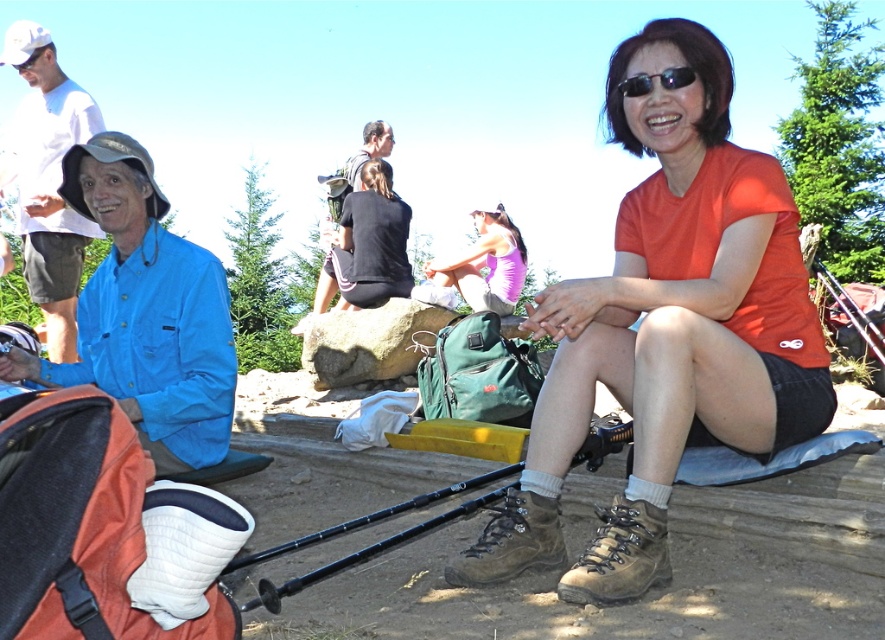
Question: Which object appears farthest from the camera in this image?

Choices:
 (A) blue fabric shirt at left
 (B) purple fabric top at center
 (C) dark gray backpack at center

Answer: (C)

Question: Which object is closer to the camera taking this photo?

Choices:
 (A) orange matte shirt at center
 (B) blue fabric jacket at upper left
 (C) blue fabric shirt at left

Answer: (A)

Question: Which object appears closest to the camera in this image?

Choices:
 (A) purple fabric top at center
 (B) dark gray backpack at center

Answer: (A)

Question: Is orange matte shirt at center to the left of black plastic pole at lower center from the viewer's perspective?

Choices:
 (A) no
 (B) yes

Answer: (A)

Question: From the image, what is the correct spatial relationship of blue fabric shirt at left in relation to purple fabric top at center?

Choices:
 (A) right
 (B) left

Answer: (B)

Question: Is the position of blue fabric jacket at upper left more distant than that of black plastic pole at lower center?

Choices:
 (A) yes
 (B) no

Answer: (A)